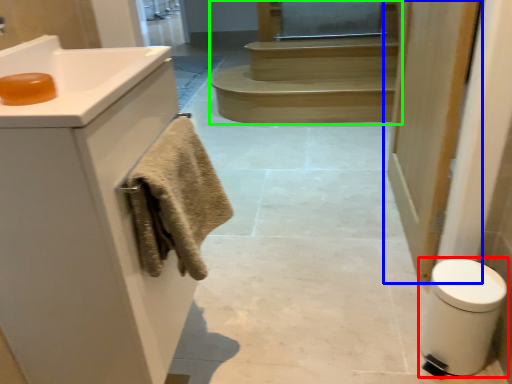
Question: Estimate the real-world distances between objects in this image. Which object is farther from bidet (highlighted by a red box), door (highlighted by a blue box) or stairs (highlighted by a green box)?

Choices:
 (A) door
 (B) stairs

Answer: (B)